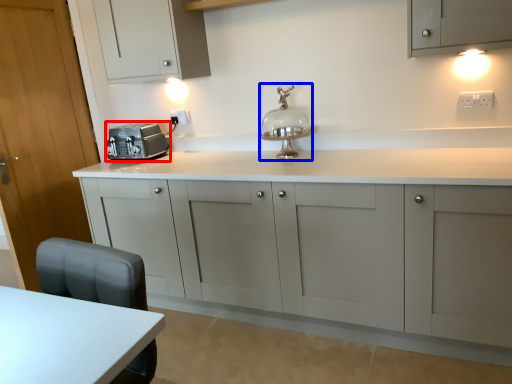
Question: Which point is closer to the camera, home appliance (highlighted by a red box) or table lamp (highlighted by a blue box)?

Choices:
 (A) home appliance
 (B) table lamp

Answer: (B)